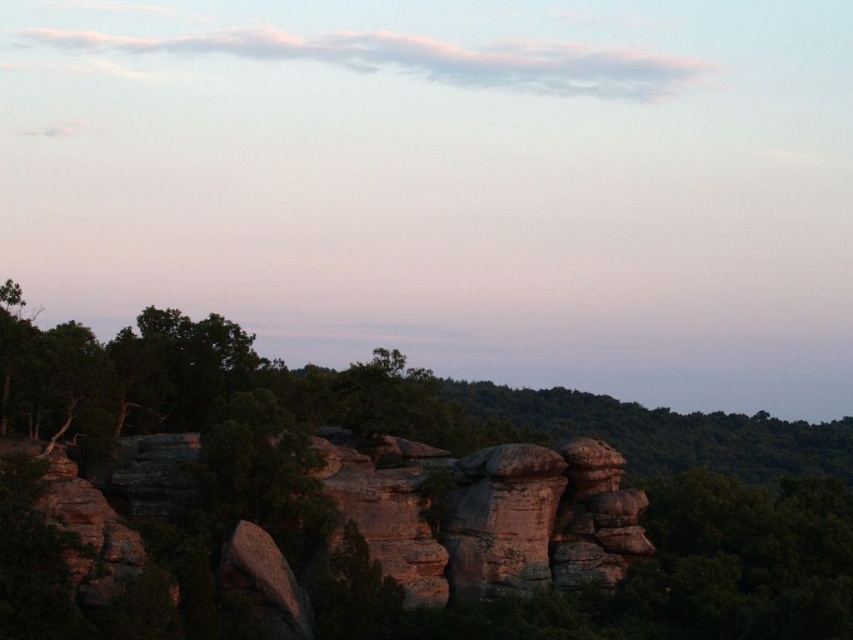
You are a hiker who wants to take a photo of the smooth rock formation at center and the green leafy tree at center. Which object should you focus on first if you want to capture both in the same frame without moving your camera?

The smooth rock formation at center is much taller than the green leafy tree at center, so you should focus on the smooth rock formation at center first to ensure it fits within the frame.

You are an explorer standing at the edge of this landscape. You notice both the smooth rock formation at center and the green leafy tree at center. Which object is positioned higher in the scene?

The smooth rock formation at center is above the green leafy tree at center, so it is positioned higher in the scene.

You are a hiker who wants to take a photo of the smooth rock formation at center and the green leafy tree at center from a distance where both are in focus. Given that your camera can focus on objects within a 150 meter range, will you be able to capture both in the same frame?

The smooth rock formation at center is 153.35 meters from the green leafy tree at center. Since your camera can focus within 150 meters, the distance between them exceeds the camera range, so you won wait be able to capture both in focus in the same frame.